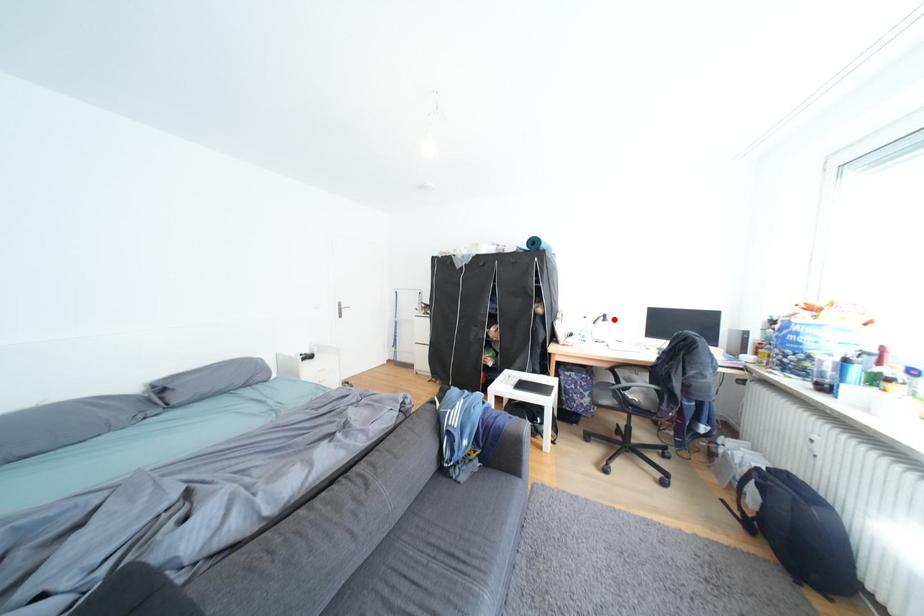
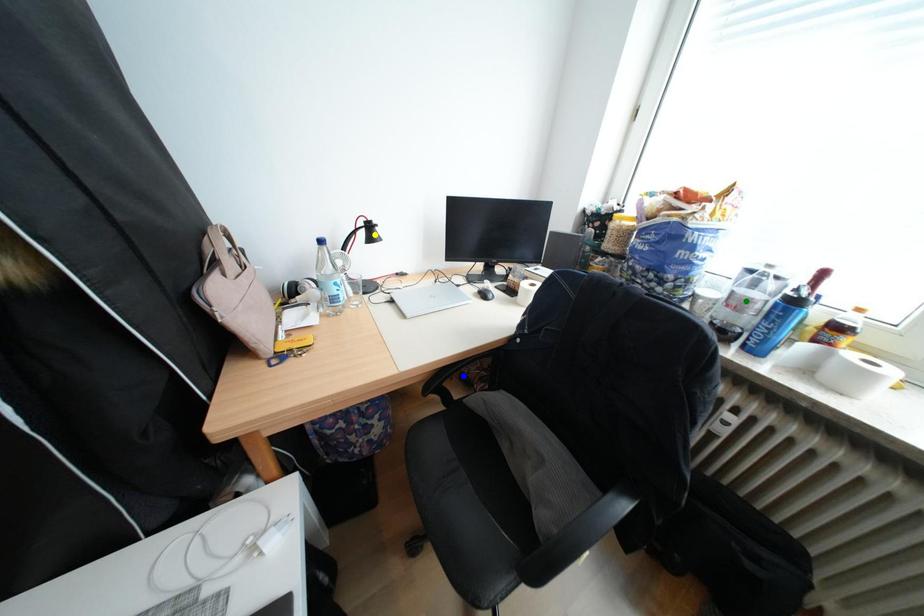
Question: I am providing you with two images of the same scene from different viewpoints. A red point is marked on the first image. You are given multiple points on the second image. Which point in image 2 is actually the same real-world point as the red point in image 1?

Choices:
 (A) green point
 (B) yellow point
 (C) blue point

Answer: (B)